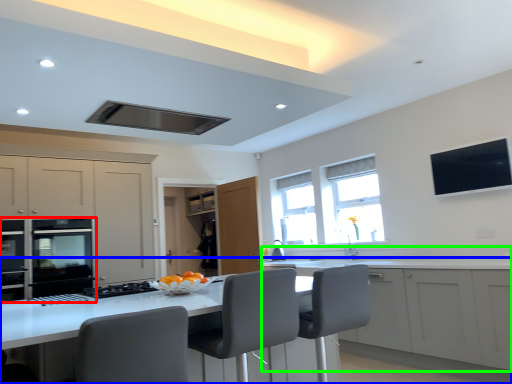
Question: Based on their relative distances, which object is nearer to home appliance (highlighted by a red box)? Choose from counter (highlighted by a blue box) and cabinetry (highlighted by a green box).

Choices:
 (A) counter
 (B) cabinetry

Answer: (A)